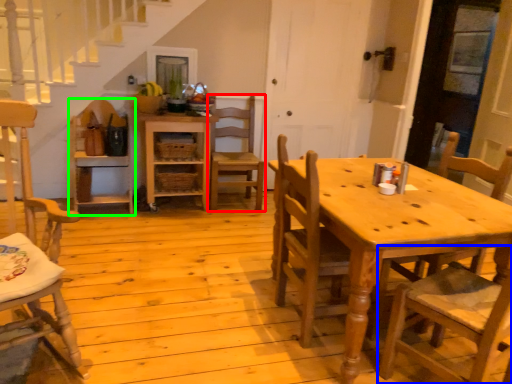
Question: Considering the real-world distances, which object is farthest from chair (highlighted by a red box)? chair (highlighted by a blue box) or chair (highlighted by a green box)?

Choices:
 (A) chair
 (B) chair

Answer: (A)